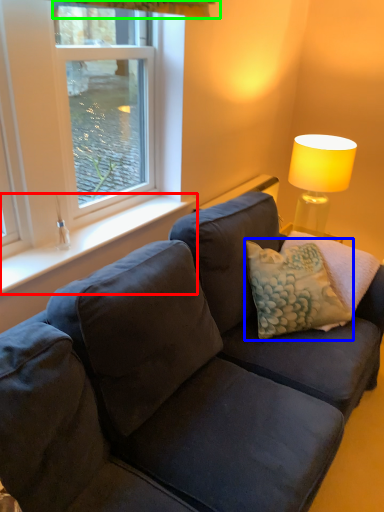
Question: Which object is the closest to the window sill (highlighted by a red box)? Choose among these: pillow (highlighted by a blue box) or curtain (highlighted by a green box).

Choices:
 (A) pillow
 (B) curtain

Answer: (A)